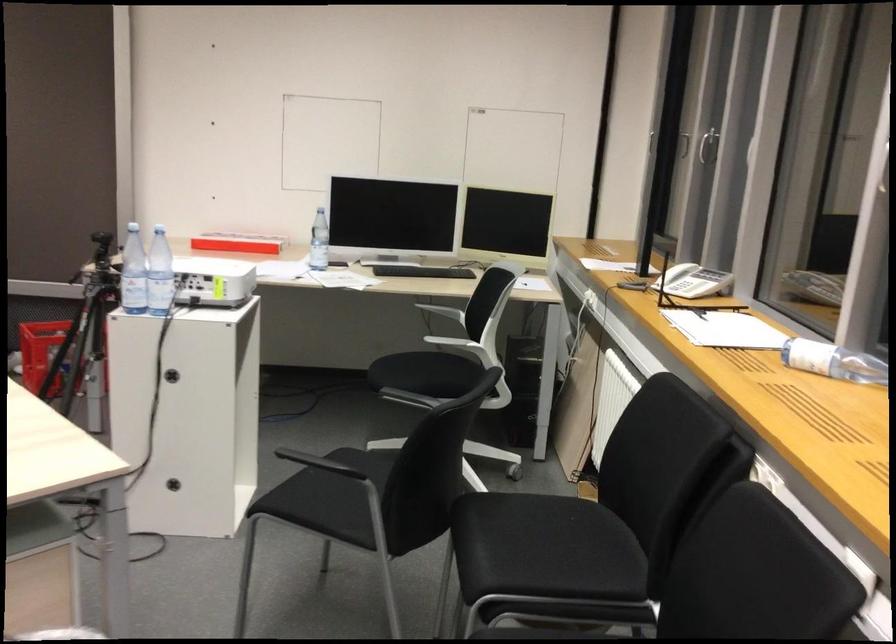
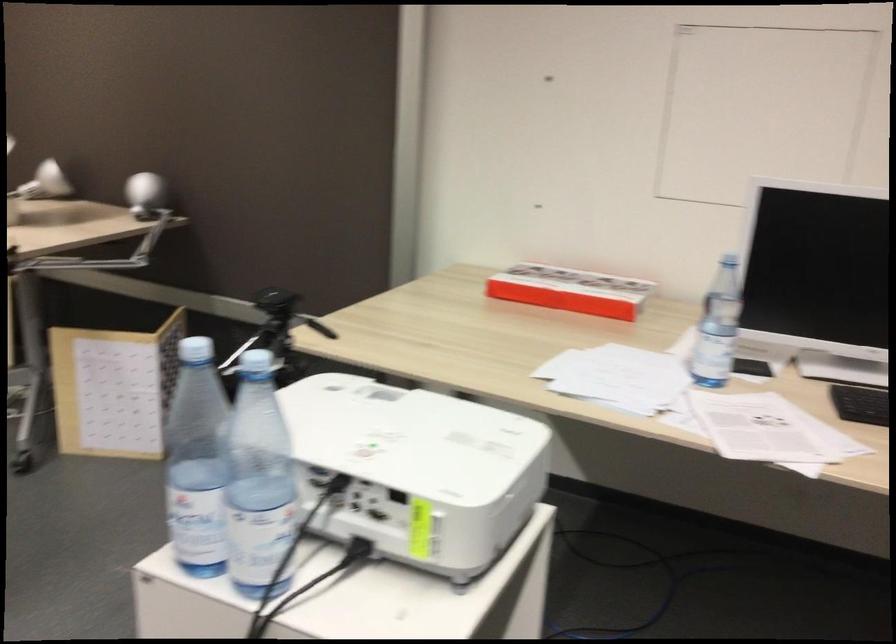
Find the pixel in the second image that matches pixel 143 279 in the first image.

(259, 482)